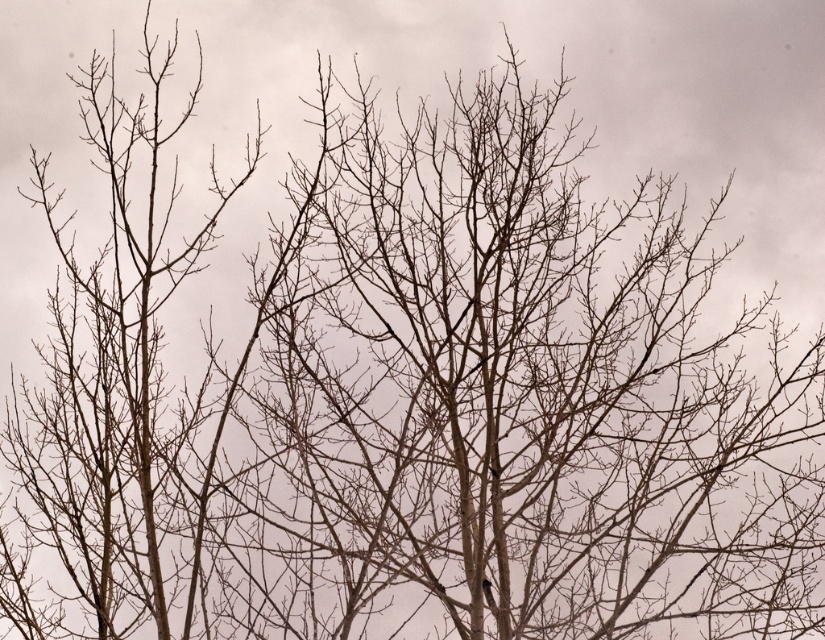
Question: Which of the following is the closest to the observer?

Choices:
 (A) [46, 528]
 (B) [535, 116]

Answer: (A)

Question: Does brown/dry wood branches at center have a greater width compared to brown matte branches at left?

Choices:
 (A) no
 (B) yes

Answer: (B)

Question: Can you confirm if brown/dry wood branches at center is positioned to the right of brown matte branches at left?

Choices:
 (A) yes
 (B) no

Answer: (A)

Question: From the image, what is the correct spatial relationship of brown/dry wood branches at center in relation to brown matte branches at left?

Choices:
 (A) above
 (B) below

Answer: (A)